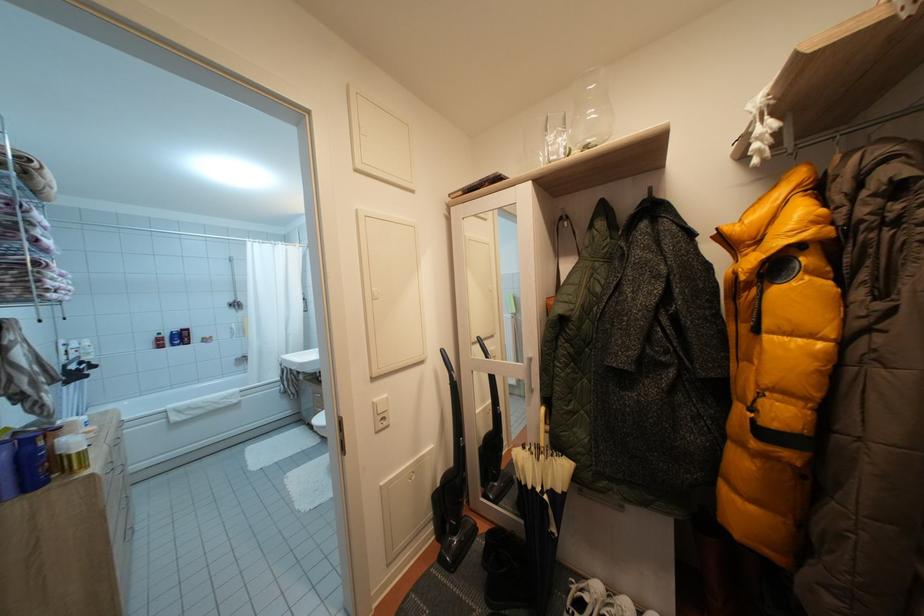
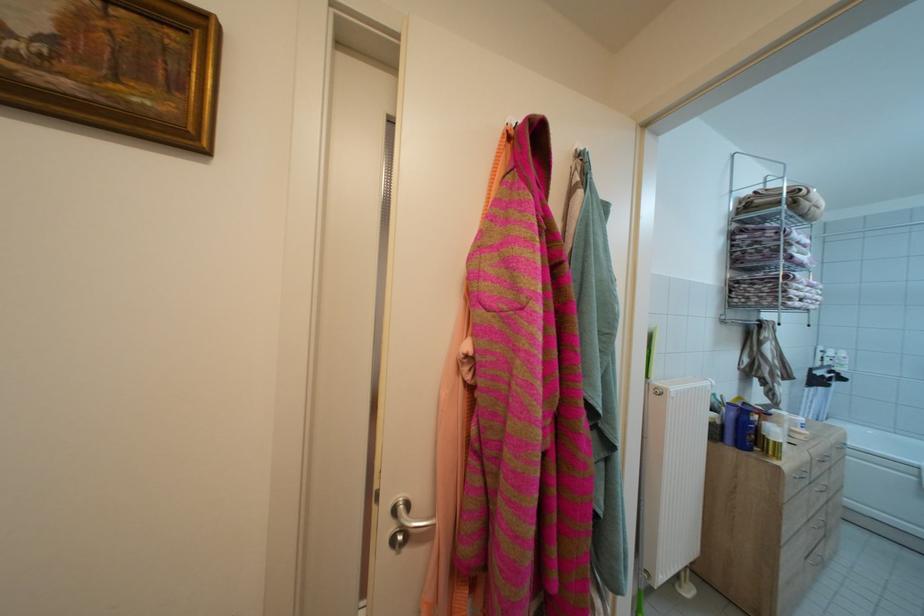
Where in the second image is the point corresponding to (80,448) from the first image?

(781, 437)